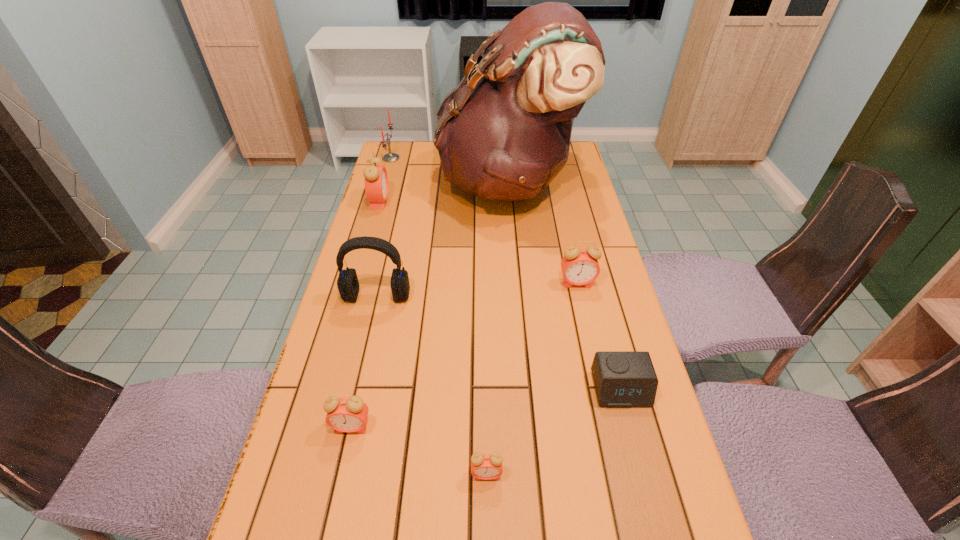
Where is `blank space located 0.130m on the face of the seventh farthest object`? blank space located 0.130m on the face of the seventh farthest object is located at coordinates (335, 502).

The height and width of the screenshot is (540, 960). Identify the location of free location located 0.200m on the front-facing side of the sixth farthest object. click(x=651, y=507).

The image size is (960, 540). What are the coordinates of `satchel that is at the far edge` in the screenshot? It's located at (505, 134).

At what (x,y) coordinates should I click in order to perform the action: click on candle at the far edge. Please return your answer as a coordinate pair (x, y). Image resolution: width=960 pixels, height=540 pixels. Looking at the image, I should click on (389, 157).

Locate an element on the screen. The width and height of the screenshot is (960, 540). headset at the left edge is located at coordinates (348, 285).

You are a GUI agent. You are given a task and a screenshot of the screen. Output one action in this format:
    pyautogui.click(x=<x>, y=<y>)
    Task: Click on the candle that is at the left edge
    The image size is (960, 540).
    Given the screenshot: What is the action you would take?
    pyautogui.click(x=389, y=157)

Where is `satchel that is at the right edge`? satchel that is at the right edge is located at coordinates (505, 134).

Find the location of `object located at the far left corner`. object located at the far left corner is located at coordinates (389, 157).

Locate an element on the screen. This screenshot has height=540, width=960. object located at the far right corner is located at coordinates (505, 134).

Locate an element on the screen. This screenshot has width=960, height=540. free space at the left edge of the desktop is located at coordinates (363, 264).